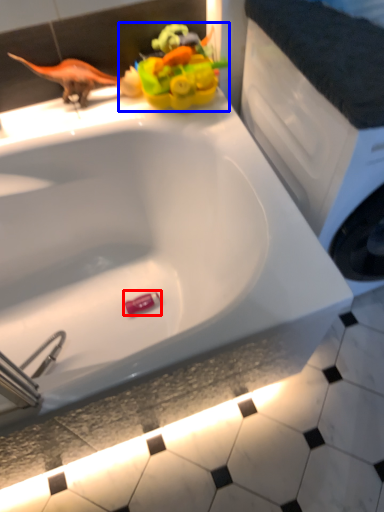
Question: Which point is closer to the camera, toy (highlighted by a red box) or toy (highlighted by a blue box)?

Choices:
 (A) toy
 (B) toy

Answer: (B)